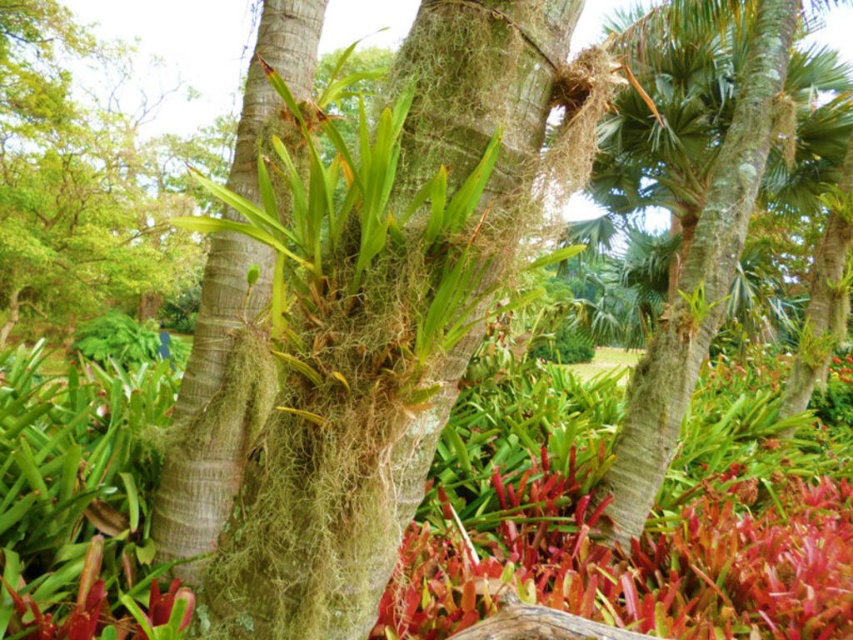
You are standing in a tropical garden and want to take a photo of the green mossy tree at center. If your camera has a maximum focus range of 50 feet, will you be able to capture the tree clearly?

The green mossy tree at center is 46.44 feet away from the camera, which is within the maximum focus range of 50 feet. Therefore, the camera can focus on the tree clearly.

You are standing in the tropical garden and want to take a photo of both the point at coordinates point (757,525) and point (90,141). Which point should you focus on first to ensure both are in focus?

You should focus on point (757,525) first because it is closer to the camera than point (90,141), ensuring both are within the depth of field.